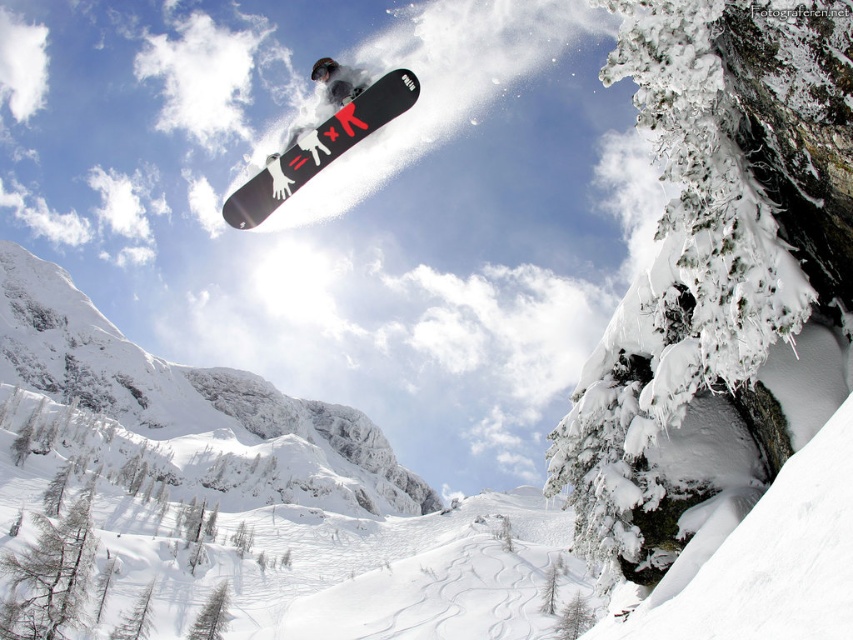
What are the coordinates of the black matte snowboard at center?

The black matte snowboard at center is located at coordinates point (318, 147).

You are a photographer capturing the snowboarder midair. You notice the black matte snowboard at center and the black matte snowboarder at center. Which object is closer to the camera?

The black matte snowboard at center is closer to the camera since it is positioned in front of the black matte snowboarder at center.

You are a photographer trying to capture the snowboarder midair. You notice two points in the scene labeled as point (329, 125) and point (352, 72). Which point is closer to the camera?

Point (329, 125) is closer to the viewer than point (352, 72).